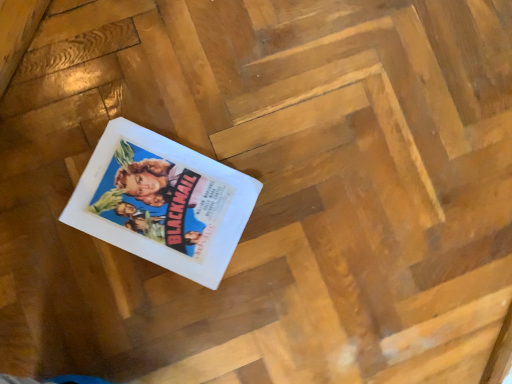
Describe the element at coordinates (162, 202) in the screenshot. I see `white paper at center` at that location.

Where is `white paper at center`? The image size is (512, 384). white paper at center is located at coordinates [x=162, y=202].

Where is `white paper at center`? white paper at center is located at coordinates (162, 202).